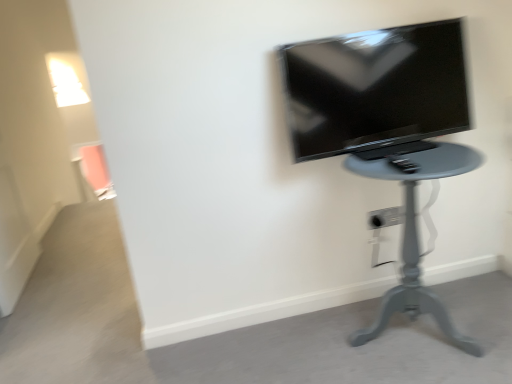
Question: Considering the relative positions of matte gray table at center and white plastic electric outlet at lower center in the image provided, is matte gray table at center to the left or to the right of white plastic electric outlet at lower center?

Choices:
 (A) right
 (B) left

Answer: (B)

Question: Is matte gray table at center in front of or behind white plastic electric outlet at lower center in the image?

Choices:
 (A) behind
 (B) front

Answer: (B)

Question: Based on their relative distances, which object is farther from the matte black tv at upper right?

Choices:
 (A) matte gray table at center
 (B) white plastic electric outlet at lower center

Answer: (B)

Question: Which of these objects is positioned farthest from the matte gray table at center?

Choices:
 (A) white plastic electric outlet at lower center
 (B) matte black tv at upper right

Answer: (A)